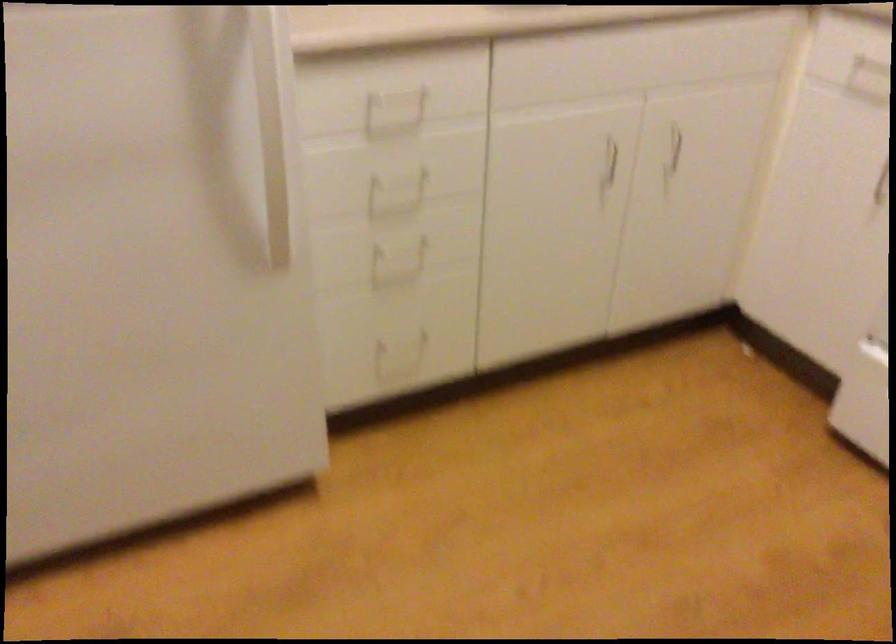
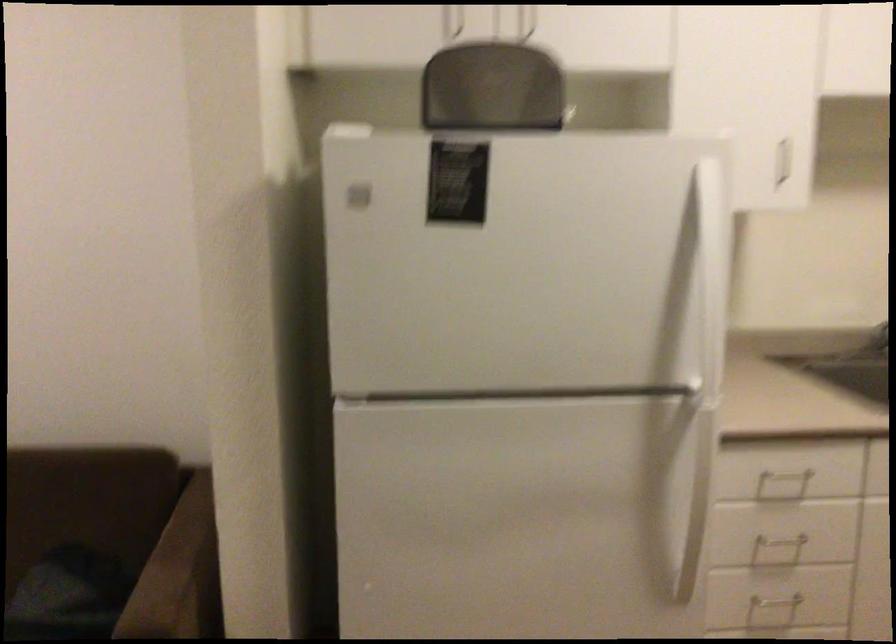
Where in the second image is the point corresponding to the point at 386,109 from the first image?

(780, 486)